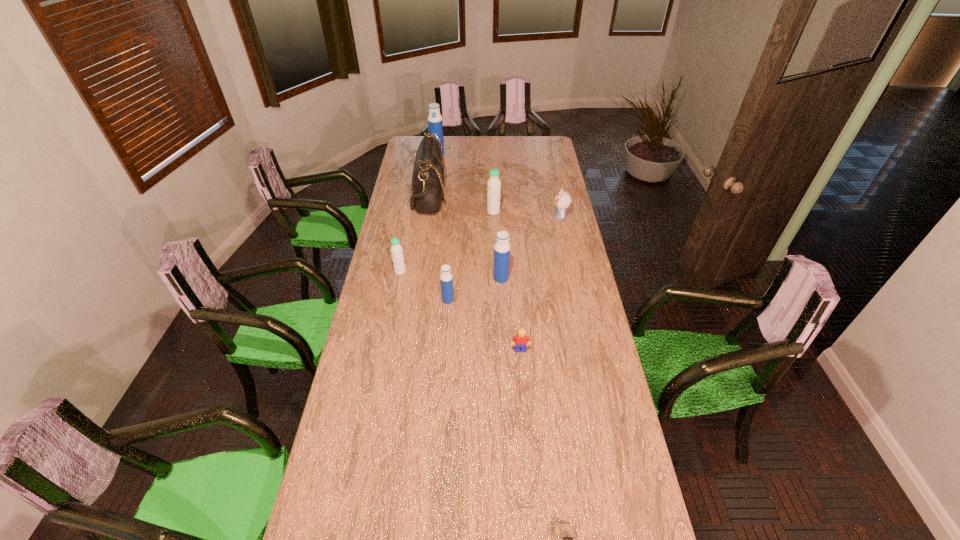
Image resolution: width=960 pixels, height=540 pixels. Identify the location of the third water bottle from left to right. (446, 278).

Locate an element on the screen. Image resolution: width=960 pixels, height=540 pixels. the third shortest object is located at coordinates (562, 200).

The image size is (960, 540). In order to click on the rightmost object in this screenshot , I will do `click(562, 200)`.

Locate an element on the screen. Image resolution: width=960 pixels, height=540 pixels. Lego is located at coordinates (519, 341).

This screenshot has height=540, width=960. I want to click on the eighth tallest object, so click(519, 341).

You are a GUI agent. You are given a task and a screenshot of the screen. Output one action in this format:
    pyautogui.click(x=<x>, y=<y>)
    Task: Click on the free space located on the front of the farthest blue water bottle
    The image size is (960, 540).
    Given the screenshot: What is the action you would take?
    pyautogui.click(x=435, y=168)

Image resolution: width=960 pixels, height=540 pixels. Find the location of `vacant position located at the front of the handbag with chain and zipper`. vacant position located at the front of the handbag with chain and zipper is located at coordinates (487, 196).

Identify the location of free space located on the front of the second farthest blue water bottle. (503, 331).

The height and width of the screenshot is (540, 960). I want to click on vacant space located on the right of the bigger white water bottle, so click(x=516, y=212).

Where is `free space located on the right of the nearer white water bottle`? Image resolution: width=960 pixels, height=540 pixels. free space located on the right of the nearer white water bottle is located at coordinates (459, 272).